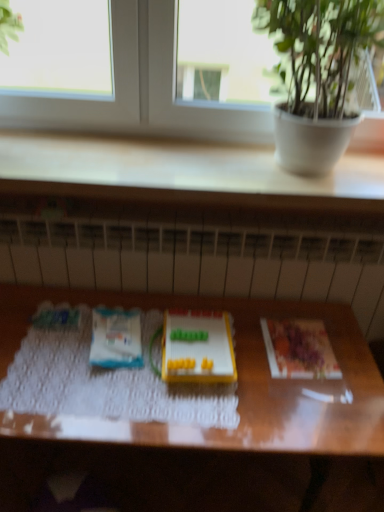
Where is `vacant area that is in front of printed paper at right, the 2th paperback book viewed from the left`? The width and height of the screenshot is (384, 512). vacant area that is in front of printed paper at right, the 2th paperback book viewed from the left is located at coordinates (307, 404).